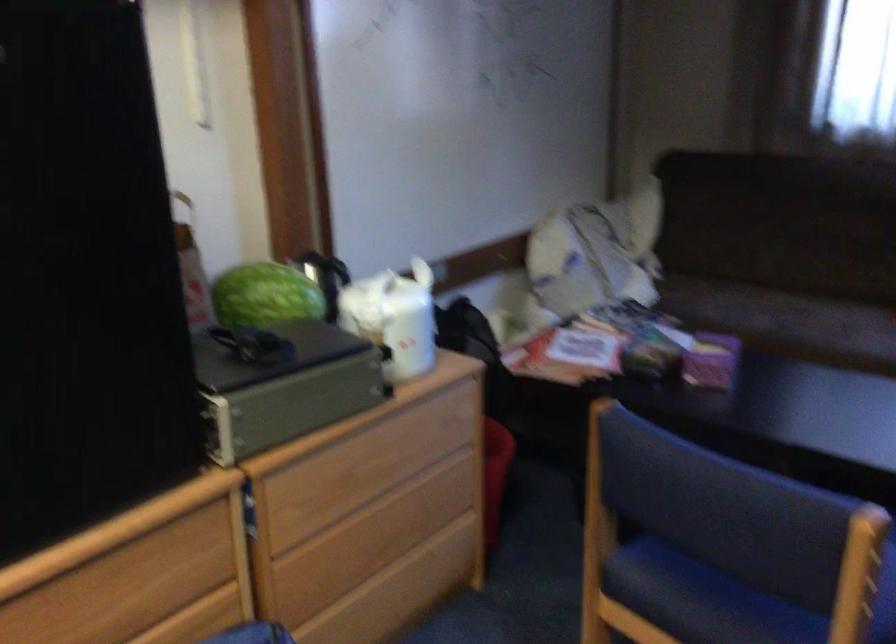
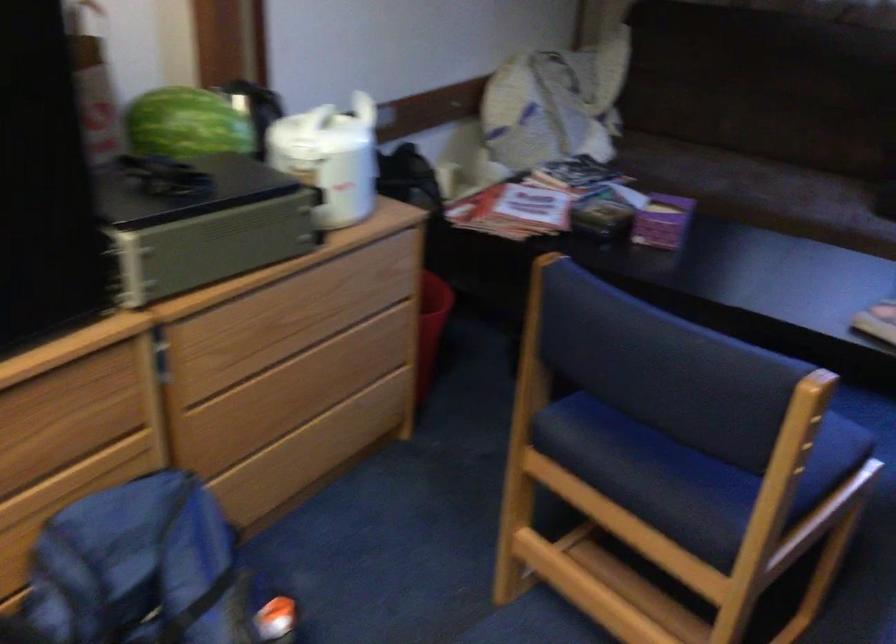
Question: In a continuous first-person perspective shot, in which direction is the camera moving?

Choices:
 (A) Left
 (B) Right
 (C) Forward
 (D) Backward

Answer: (C)